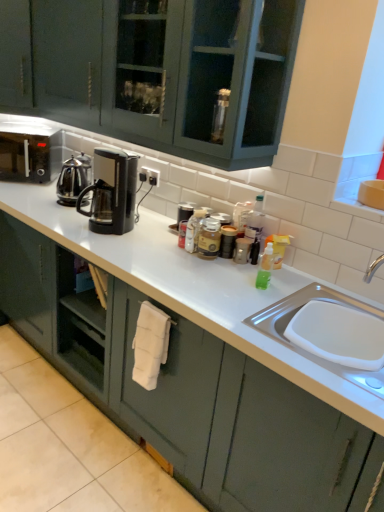
The width and height of the screenshot is (384, 512). I want to click on vacant space positioned to the left of polished stainless steel kettle at left, the 2th kitchen appliance positioned from the right, so click(x=44, y=197).